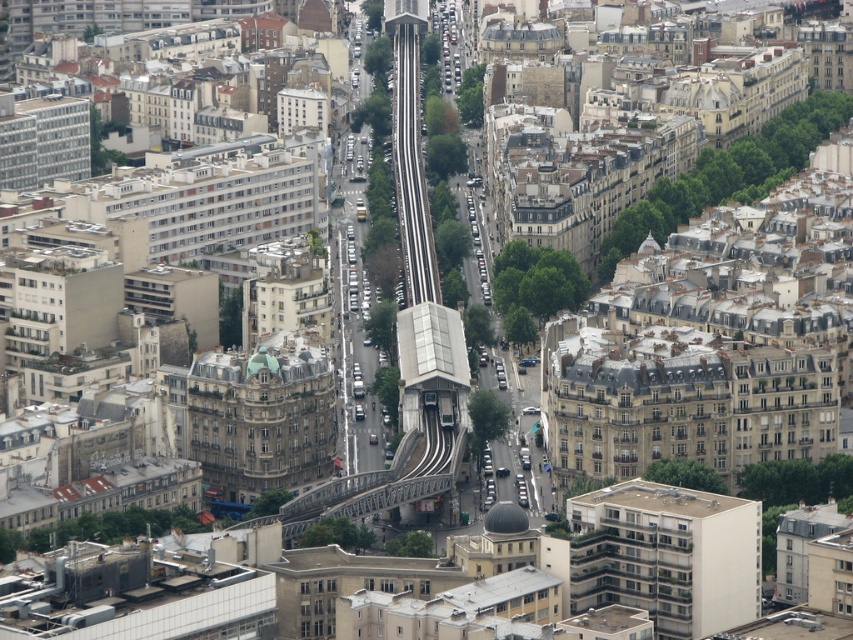
You are a drone operator flying a drone over the city. You need to capture a photo of the white smooth building at center without the black rubber train track at center appearing in the frame. Is this possible given their positions?

The white smooth building at center is in front of the black rubber train track at center, so if positioned correctly, the drone can capture the building without the track obstructing the view.

You are a city planner analyzing the urban layout. Given the white smooth building at center and the black rubber train track at center, which one has a larger width in the image?

The white smooth building at center might be wider than black rubber train track at center according to the description provided.

You are a drone operator and need to fly a drone from the monorail track in the center to the white smooth building at center. Given that the drone has a maximum range of 800 feet, will it be able to reach the destination without recharging?

The distance between the monorail track in the center and the white smooth building at center is 823.73 feet, which exceeds the drone operator maximum range of 800 feet. Therefore, the drone will not be able to reach the destination without recharging.